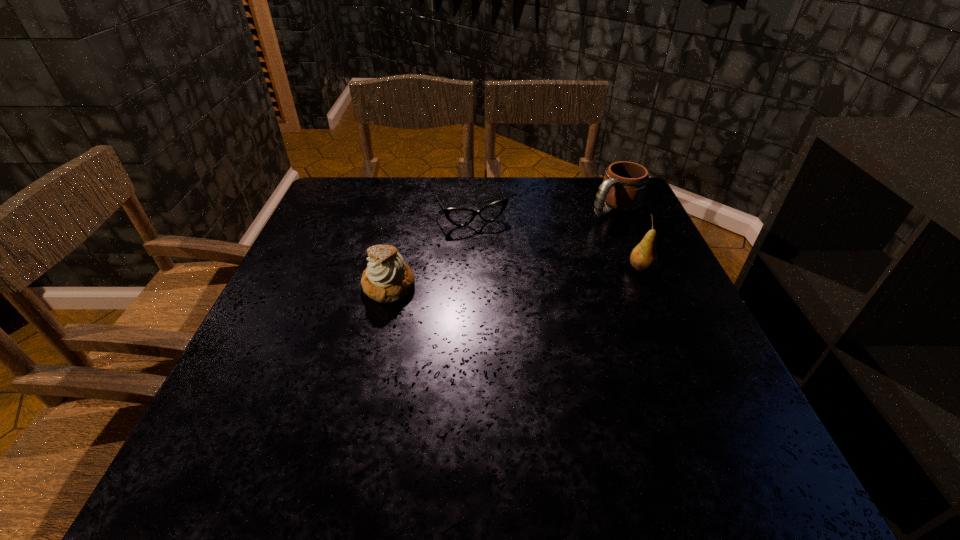
At what (x,y) coordinates should I click in order to perform the action: click on the leftmost object. Please return your answer as a coordinate pair (x, y). Image resolution: width=960 pixels, height=540 pixels. Looking at the image, I should click on (387, 279).

This screenshot has width=960, height=540. Identify the location of pear. (643, 258).

This screenshot has height=540, width=960. In order to click on mug in this screenshot , I will do `click(624, 185)`.

This screenshot has height=540, width=960. Find the location of `the third object from right to left`. the third object from right to left is located at coordinates (459, 217).

Locate an element on the screen. This screenshot has width=960, height=540. the shortest object is located at coordinates (459, 217).

Image resolution: width=960 pixels, height=540 pixels. I want to click on free space located 0.050m on the front of the pastry, so click(x=381, y=322).

Locate an element on the screen. vacant space located 0.070m on the left of the tallest object is located at coordinates (598, 268).

I want to click on vacant point located 0.280m on the side of the mug with the handle, so click(x=530, y=262).

Where is `vacant area located 0.150m on the side of the mug with the handle`? The width and height of the screenshot is (960, 540). vacant area located 0.150m on the side of the mug with the handle is located at coordinates (564, 240).

The image size is (960, 540). Identify the location of vacant space situated 0.180m on the side of the mug with the handle. (557, 245).